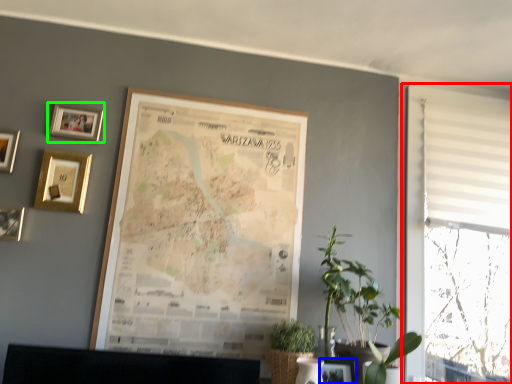
Question: Which is farther away from window (highlighted by a red box)? picture frame (highlighted by a blue box) or picture frame (highlighted by a green box)?

Choices:
 (A) picture frame
 (B) picture frame

Answer: (B)